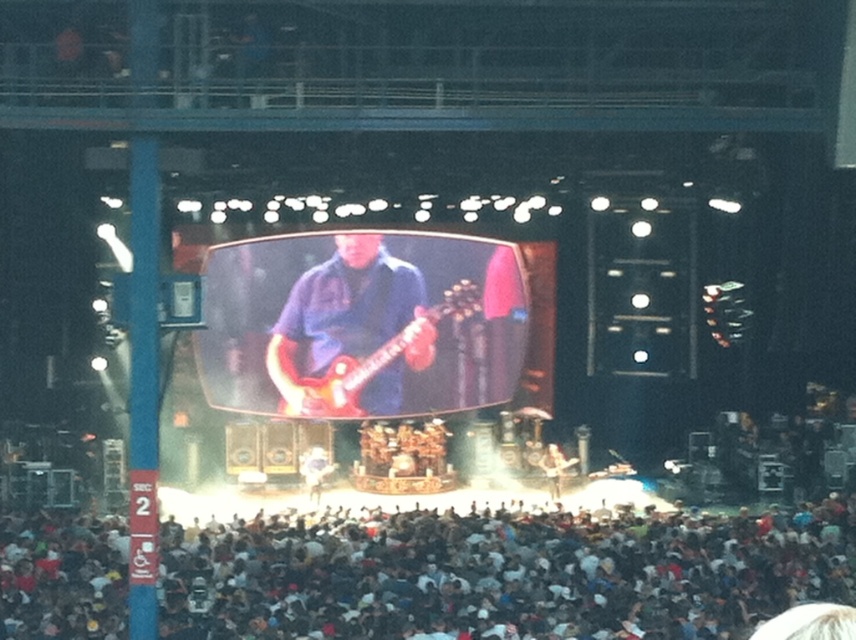
Which is below, white cotton crowd at lower center or shiny red electric guitar at center?

white cotton crowd at lower center is below.

Is white cotton crowd at lower center positioned at the back of shiny red electric guitar at center?

No, it is not.

At what (x,y) coordinates should I click in order to perform the action: click on white cotton crowd at lower center. Please return your answer as a coordinate pair (x, y). This screenshot has width=856, height=640. Looking at the image, I should click on click(x=503, y=573).